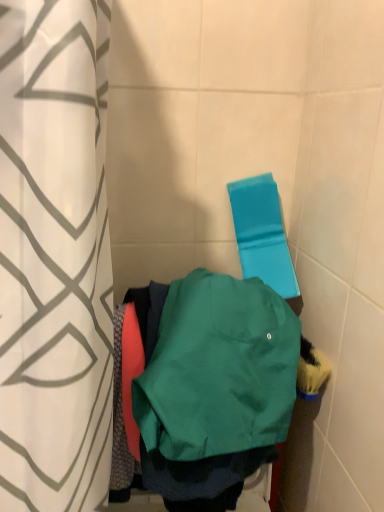
At what (x,y) coordinates should I click in order to perform the action: click on white fabric curtain at left. Please return your answer as a coordinate pair (x, y). The image size is (384, 512). Looking at the image, I should click on (54, 256).

What is the approximate width of white fabric curtain at left?

9.54 inches.

The width and height of the screenshot is (384, 512). What do you see at coordinates (218, 369) in the screenshot?
I see `green matte sweatshirt at center` at bounding box center [218, 369].

What are the coordinates of `white fabric curtain at left` in the screenshot? It's located at (54, 256).

Is green matte sweatshirt at center looking in the opposite direction of blue fabric beach towel at upper right?

That's right, green matte sweatshirt at center is facing away from blue fabric beach towel at upper right.

Is green matte sweatshirt at center taller than blue fabric beach towel at upper right?

Incorrect, the height of green matte sweatshirt at center is not larger of that of blue fabric beach towel at upper right.

Is point (273, 383) closer or farther from the camera than point (262, 195)?

Point (273, 383) is closer to the camera than point (262, 195).

Is green matte sweatshirt at center spatially inside blue fabric beach towel at upper right, or outside of it?

green matte sweatshirt at center exists outside the volume of blue fabric beach towel at upper right.

Can you confirm if green matte sweatshirt at center is wider than white fabric curtain at left?

No, green matte sweatshirt at center is not wider than white fabric curtain at left.

Is green matte sweatshirt at center turned away from white fabric curtain at left?

No, green matte sweatshirt at center is not facing the opposite direction of white fabric curtain at left.

Considering the sizes of objects green matte sweatshirt at center and white fabric curtain at left in the image provided, who is bigger, green matte sweatshirt at center or white fabric curtain at left?

white fabric curtain at left.

What's the angular difference between green matte sweatshirt at center and white fabric curtain at left's facing directions?

The facing directions of green matte sweatshirt at center and white fabric curtain at left are 79.7 degrees apart.

Is white fabric curtain at left positioned with its back to blue fabric beach towel at upper right?

white fabric curtain at left is not turned away from blue fabric beach towel at upper right.

Is white fabric curtain at left surrounding blue fabric beach towel at upper right?

Definitely not — blue fabric beach towel at upper right is not inside white fabric curtain at left.

Between white fabric curtain at left and blue fabric beach towel at upper right, which one appears on the right side from the viewer's perspective?

blue fabric beach towel at upper right.

From a real-world perspective, is white fabric curtain at left located beneath blue fabric beach towel at upper right?

Indeed, from a real-world perspective, white fabric curtain at left is positioned beneath blue fabric beach towel at upper right.

Locate an element on the screen. beach towel on the right of white fabric curtain at left is located at coordinates (262, 234).

How many degrees apart are the facing directions of blue fabric beach towel at upper right and white fabric curtain at left?

79.7 degrees.

Is blue fabric beach towel at upper right oriented away from white fabric curtain at left?

No, blue fabric beach towel at upper right is not facing the opposite direction of white fabric curtain at left.

How far apart are white fabric curtain at left and green matte sweatshirt at center?

white fabric curtain at left is 9.89 inches away from green matte sweatshirt at center.

Which object is more forward, white fabric curtain at left or green matte sweatshirt at center?

white fabric curtain at left is in front.

Between white fabric curtain at left and green matte sweatshirt at center, which one appears on the right side from the viewer's perspective?

From the viewer's perspective, green matte sweatshirt at center appears more on the right side.

Between white fabric curtain at left and green matte sweatshirt at center, which one has less height?

With less height is green matte sweatshirt at center.

What's the angular difference between blue fabric beach towel at upper right and green matte sweatshirt at center's facing directions?

0.00255 degrees.

Is blue fabric beach towel at upper right positioned beyond the bounds of green matte sweatshirt at center?

Yes.

Is blue fabric beach towel at upper right taller than green matte sweatshirt at center?

Indeed, blue fabric beach towel at upper right has a greater height compared to green matte sweatshirt at center.

Considering the positions of objects blue fabric beach towel at upper right and green matte sweatshirt at center in the image provided, who is more to the right, blue fabric beach towel at upper right or green matte sweatshirt at center?

blue fabric beach towel at upper right.

Find the location of a particular element. This screenshot has width=384, height=512. sweatshirt below the blue fabric beach towel at upper right (from a real-world perspective) is located at coordinates pos(218,369).

This screenshot has height=512, width=384. Identify the location of sweatshirt on the right side of white fabric curtain at left. (218, 369).

Based on their spatial positions, is green matte sweatshirt at center or blue fabric beach towel at upper right closer to white fabric curtain at left?

Among the two, green matte sweatshirt at center is located nearer to white fabric curtain at left.

Which object lies further to the anchor point white fabric curtain at left, blue fabric beach towel at upper right or green matte sweatshirt at center?

The object further to white fabric curtain at left is blue fabric beach towel at upper right.

Which object lies further to the anchor point blue fabric beach towel at upper right, green matte sweatshirt at center or white fabric curtain at left?

white fabric curtain at left is positioned further to the anchor blue fabric beach towel at upper right.

Based on their spatial positions, is blue fabric beach towel at upper right or white fabric curtain at left closer to green matte sweatshirt at center?

white fabric curtain at left is closer to green matte sweatshirt at center.

Which object lies further to the anchor point green matte sweatshirt at center, white fabric curtain at left or blue fabric beach towel at upper right?

blue fabric beach towel at upper right is further to green matte sweatshirt at center.

Estimate the real-world distances between objects in this image. Which object is closer to blue fabric beach towel at upper right, white fabric curtain at left or green matte sweatshirt at center?

green matte sweatshirt at center is positioned closer to the anchor blue fabric beach towel at upper right.

What are the coordinates of `sweatshirt positioned between white fabric curtain at left and blue fabric beach towel at upper right from near to far` in the screenshot? It's located at (218, 369).